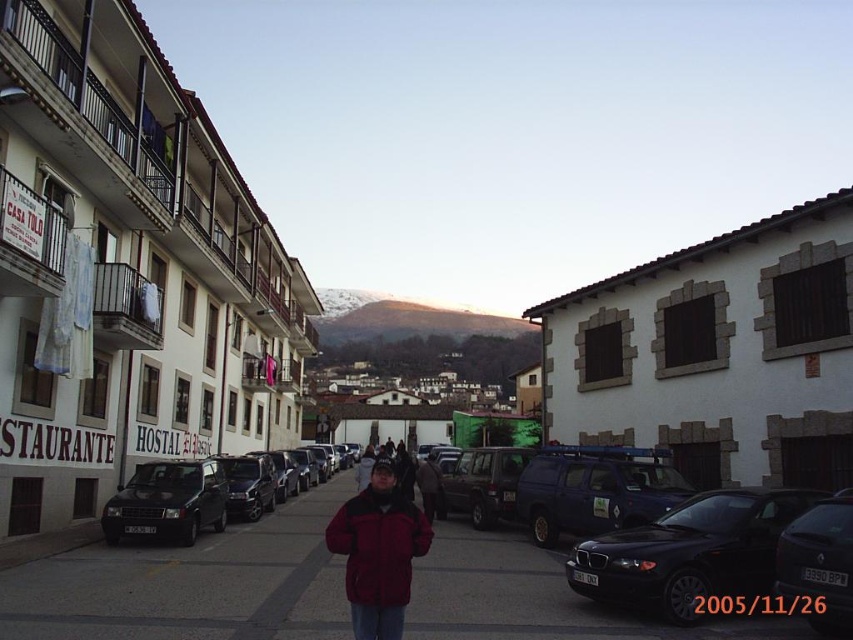
Question: Which point is closer to the camera taking this photo?

Choices:
 (A) (367, 536)
 (B) (598, 589)
 (C) (815, 566)
 (D) (77, 609)

Answer: (C)

Question: Does shiny black sedan at center have a larger size compared to dark red fleece jacket at center?

Choices:
 (A) no
 (B) yes

Answer: (A)

Question: Can you confirm if shiny black sedan at center is thinner than black glossy car at center?

Choices:
 (A) no
 (B) yes

Answer: (A)

Question: Can you confirm if shiny black sedan at center is wider than black glossy car at center?

Choices:
 (A) no
 (B) yes

Answer: (B)

Question: Which point is farther to the camera?

Choices:
 (A) click(328, 548)
 (B) click(683, 621)
 (C) click(107, 508)
 (D) click(817, 570)

Answer: (A)

Question: Estimate the real-world distances between objects in this image. Which object is closer to the shiny black sedan at center?

Choices:
 (A) black glossy car at center
 (B) matte black van at left

Answer: (A)